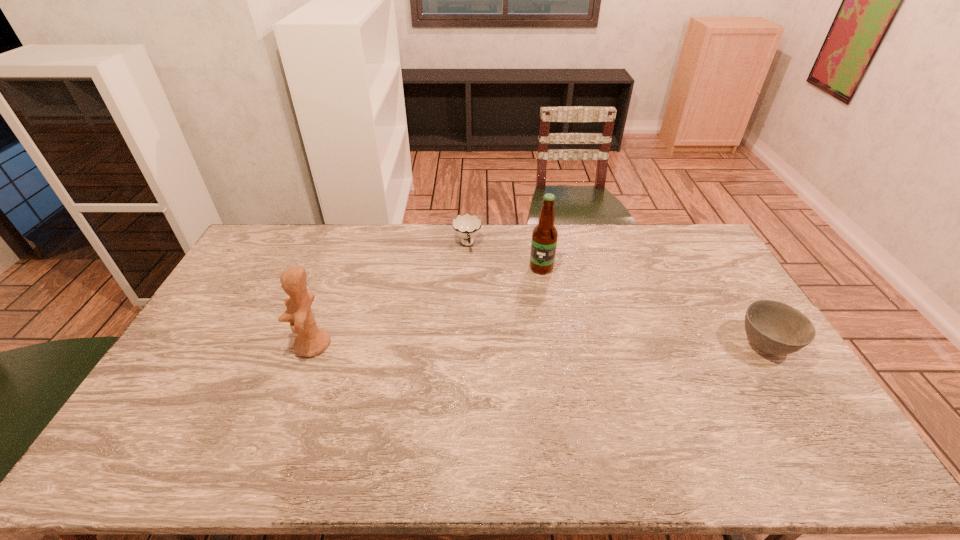
Find the location of a particular element. This screenshot has width=960, height=540. vacant space at the near edge of the desktop is located at coordinates (416, 414).

The height and width of the screenshot is (540, 960). In the image, there is a desktop. In order to click on vacant space at the left edge in this screenshot , I will do `click(234, 272)`.

You are a GUI agent. You are given a task and a screenshot of the screen. Output one action in this format:
    pyautogui.click(x=<x>, y=<y>)
    Task: Click on the vacant space at the right edge
    
    Given the screenshot: What is the action you would take?
    pyautogui.click(x=692, y=287)

At what (x,y) coordinates should I click in order to perform the action: click on vacant space at the far left corner. Please return your answer as a coordinate pair (x, y). The width and height of the screenshot is (960, 540). Looking at the image, I should click on (280, 250).

Locate an element on the screen. This screenshot has width=960, height=540. vacant space that's between the rightmost object and the leftmost object is located at coordinates (540, 345).

Find the location of `vacant space that's between the beer bottle and the second object from left to right`. vacant space that's between the beer bottle and the second object from left to right is located at coordinates (504, 256).

The height and width of the screenshot is (540, 960). In order to click on free area in between the rightmost object and the leftmost object in this screenshot , I will do `click(540, 345)`.

This screenshot has width=960, height=540. I want to click on unoccupied position between the figurine and the cup, so click(x=390, y=295).

Identify the location of free space between the rightmost object and the second farthest object. (654, 306).

The height and width of the screenshot is (540, 960). Find the location of `vacant space in between the bowl and the figurine`. vacant space in between the bowl and the figurine is located at coordinates (540, 345).